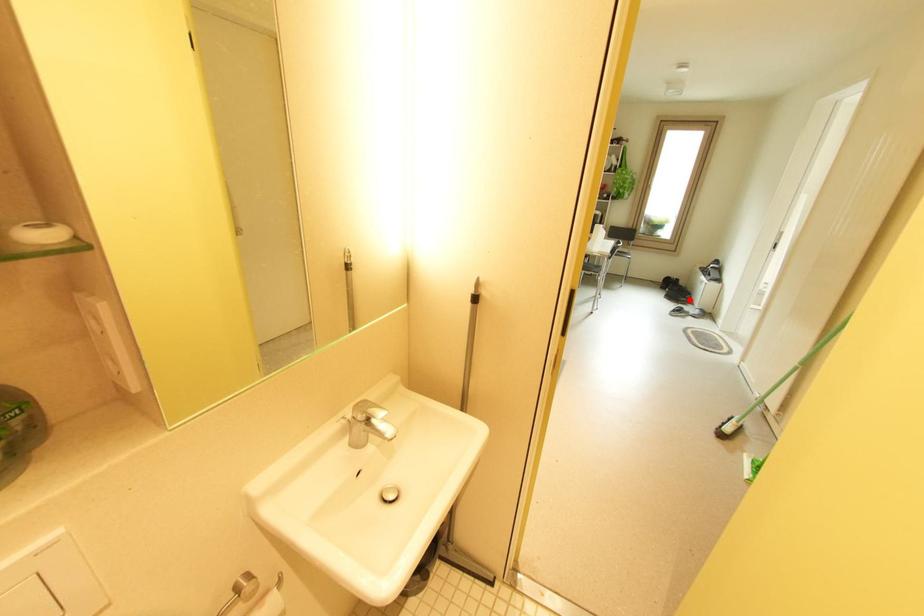
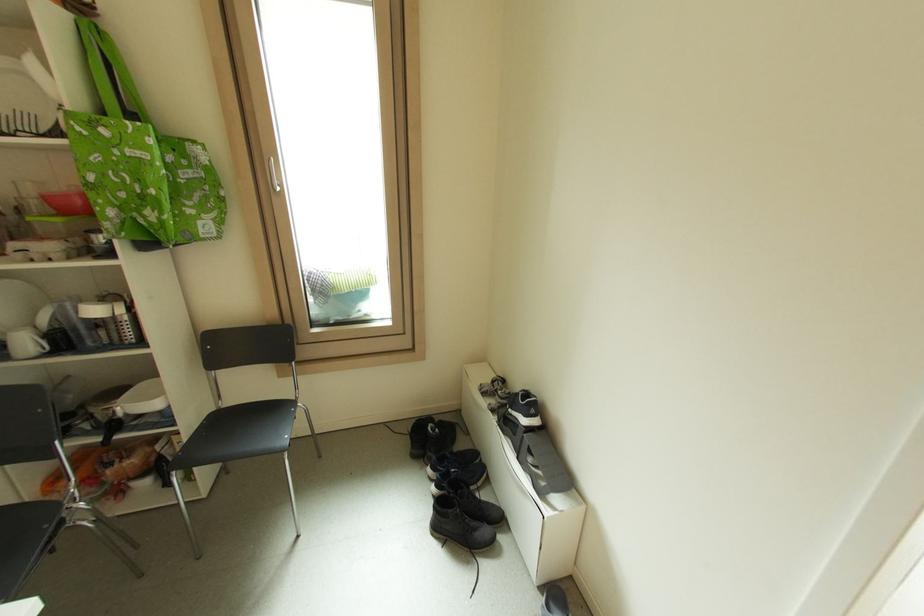
In the second image, find the point that corresponds to the highlighted location in the first image.

(490, 532)